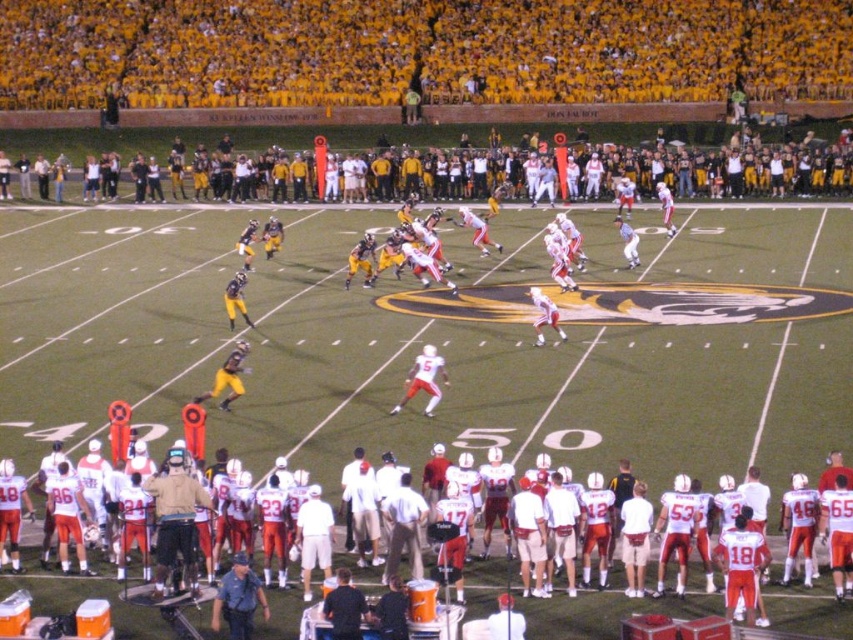
Is yellow jersey at upper center smaller than white matte uniform at center?

No.

Is yellow jersey at upper center to the right of white matte uniform at center from the viewer's perspective?

Incorrect, yellow jersey at upper center is not on the right side of white matte uniform at center.

Is point (323, 100) positioned after point (280, 625)?

Yes.

Where is `yellow jersey at upper center`? Image resolution: width=853 pixels, height=640 pixels. yellow jersey at upper center is located at coordinates (419, 51).